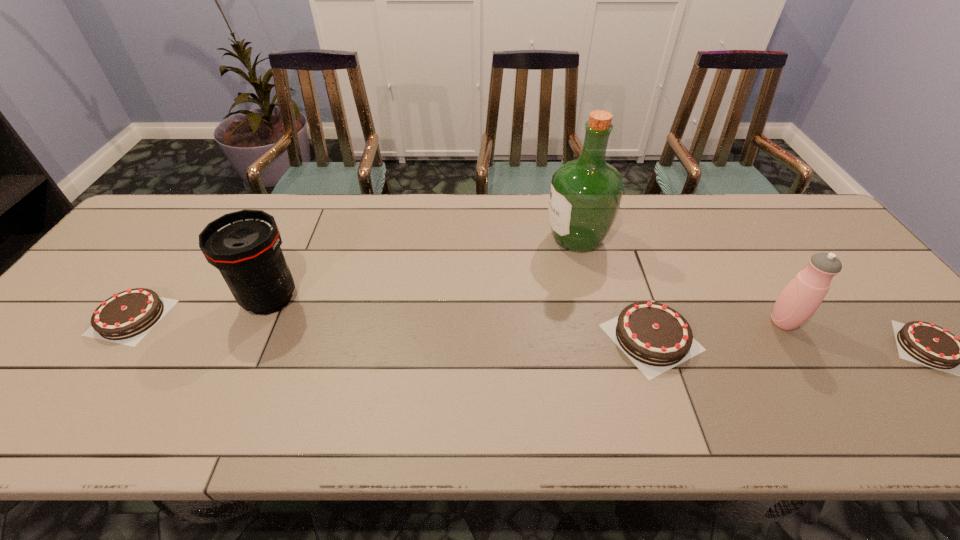
In the image, there is a desktop. Identify the location of free space at the right edge. coord(849,277).

The image size is (960, 540). I want to click on free location at the far left corner, so click(164, 235).

You are a GUI agent. You are given a task and a screenshot of the screen. Output one action in this format:
    pyautogui.click(x=<x>, y=<y>)
    Task: Click on the free space at the near left corner of the desktop
    The image size is (960, 540).
    Given the screenshot: What is the action you would take?
    pyautogui.click(x=46, y=370)

Where is `free spot between the second chocolate cake from left to right and the thermos bottle`? Image resolution: width=960 pixels, height=540 pixels. free spot between the second chocolate cake from left to right and the thermos bottle is located at coordinates (717, 329).

Where is `vacant point located between the second chocolate cake from left to right and the farthest object`? The height and width of the screenshot is (540, 960). vacant point located between the second chocolate cake from left to right and the farthest object is located at coordinates (613, 288).

Image resolution: width=960 pixels, height=540 pixels. What are the coordinates of `free spot between the second object from right to left and the fifth object from right to left` in the screenshot? It's located at (527, 310).

The image size is (960, 540). In order to click on free space between the tallest object and the fifth tallest object in this screenshot , I will do `click(354, 278)`.

Locate an element on the screen. This screenshot has height=540, width=960. free point between the thermos bottle and the telephoto lens is located at coordinates (527, 310).

At what (x,y) coordinates should I click in order to perform the action: click on free space between the leftmost object and the second chocolate cake from left to right. Please return your answer as a coordinate pair (x, y). Looking at the image, I should click on (392, 327).

The width and height of the screenshot is (960, 540). What are the coordinates of `vacant point located between the tallest object and the second chocolate cake from right to left` in the screenshot? It's located at (613, 288).